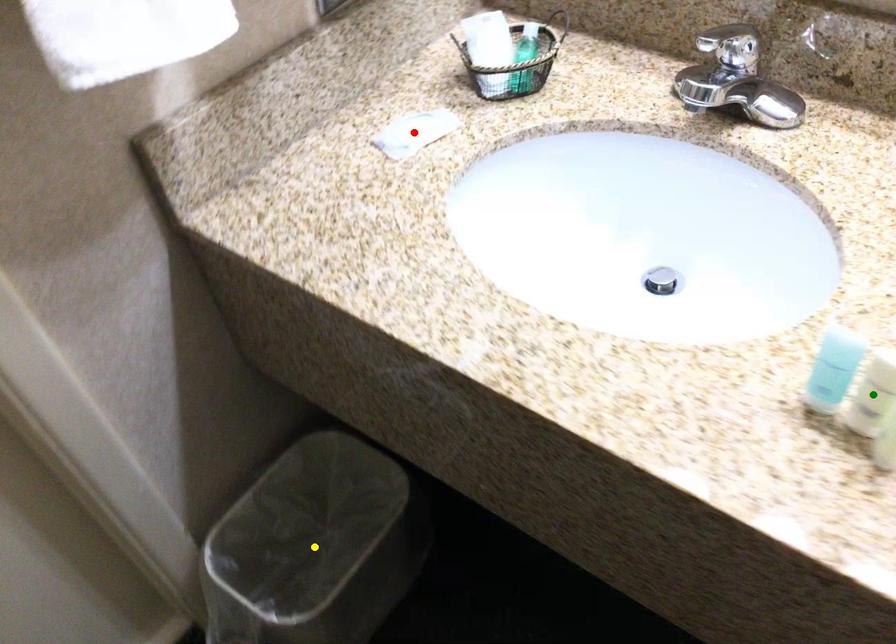
Order these from nearest to farthest:
1. yellow point
2. green point
3. red point

yellow point → red point → green point